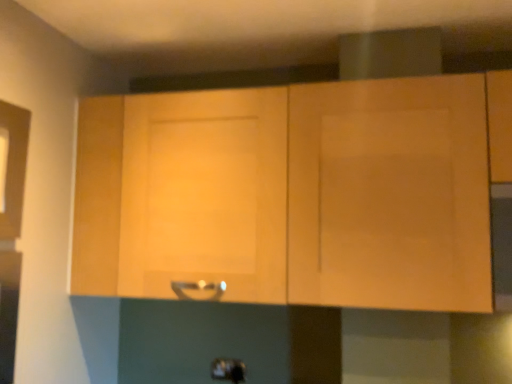
Question: Visually, is light wood cabinet at center positioned to the left or to the right of satin silver handle at center?

Choices:
 (A) left
 (B) right

Answer: (B)

Question: From a real-world perspective, is light wood cabinet at center physically located above or below satin silver handle at center?

Choices:
 (A) above
 (B) below

Answer: (A)

Question: Does point (296, 134) appear closer or farther from the camera than point (219, 362)?

Choices:
 (A) farther
 (B) closer

Answer: (B)

Question: From the image's perspective, is satin silver handle at center above or below light wood cabinet at center?

Choices:
 (A) below
 (B) above

Answer: (A)

Question: Is point (224, 372) positioned closer to the camera than point (384, 236)?

Choices:
 (A) farther
 (B) closer

Answer: (A)

Question: Considering the positions of satin silver handle at center and light wood cabinet at center in the image, is satin silver handle at center wider or thinner than light wood cabinet at center?

Choices:
 (A) thin
 (B) wide

Answer: (A)

Question: In the image, is satin silver handle at center on the left side or the right side of light wood cabinet at center?

Choices:
 (A) right
 (B) left

Answer: (B)